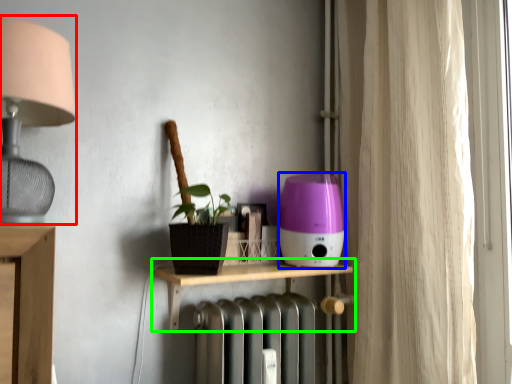
Question: Which object is positioned farthest from lamp (highlighted by a red box)? Select from appliance (highlighted by a blue box) and shelf (highlighted by a green box).

Choices:
 (A) appliance
 (B) shelf

Answer: (A)